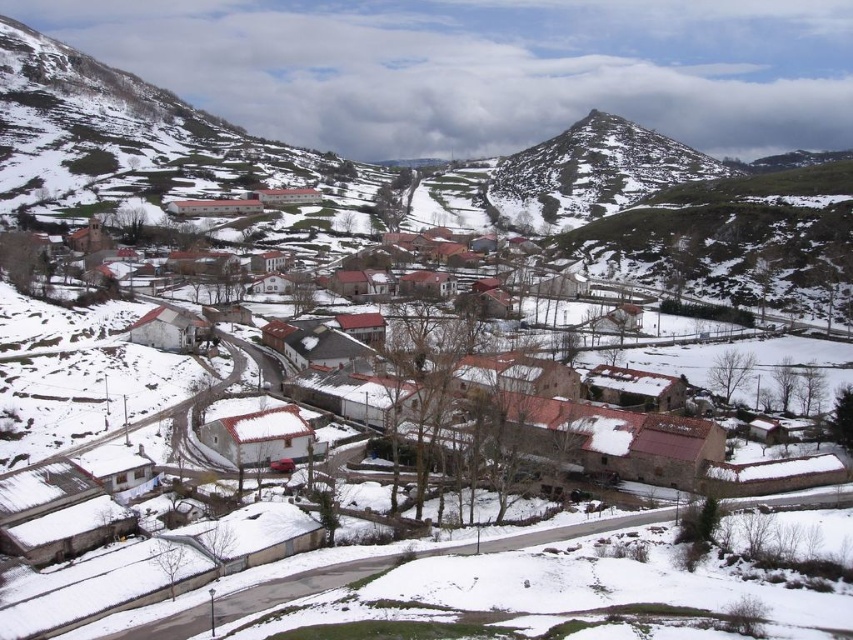
You are standing at the origin point of the coordinate system in the image. Which direction should you move to reach the white stone houses at center?

You should move towards the direction of point (645, 448) to reach the white stone houses at center.

You are planning to build a new cabin in this snowy village. You have two options for locations based on the image. The first is near the white stone houses at center, and the second is near the green grassy peak at upper right. Considering the space available, which location offers a wider area for construction?

The green grassy peak at upper right offers a wider area for construction since its width is greater than the white stone houses at center.